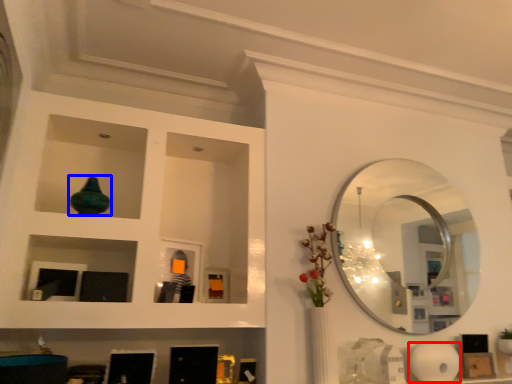
Question: Which point is closer to the camera, paper towel (highlighted by a red box) or glass vase (highlighted by a blue box)?

Choices:
 (A) paper towel
 (B) glass vase

Answer: (B)